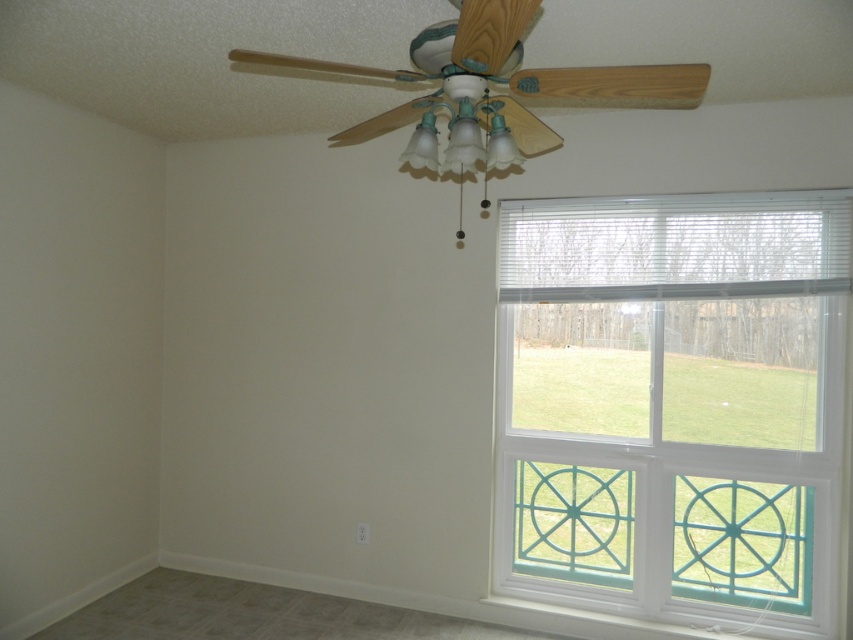
From the picture: You are standing in the room and want to know which object is wider between the white glass window at right and the wooden ceiling fan at upper center. Can you determine which one is wider?

The white glass window at right is wider than the wooden ceiling fan at upper center because its width surpasses the wooden ceiling fan at upper center.

You are standing in the corner of the room and want to look out the window. Which direction should you turn to face the white glass window at right from the wooden ceiling fan at upper center?

The white glass window at right is positioned on the right side of the wooden ceiling fan at upper center, so you should turn to your right to face the white glass window at right.

You are an interior designer planning to install a new light fixture in this room. The existing wooden ceiling fan at upper center is in the way of your desired placement. Can you replace it with the new fixture if the white glass window at right is larger?

The white glass window at right is larger than the wooden ceiling fan at upper center, so replacing the wooden ceiling fan at upper center with a new fixture should be possible since the window size does not directly affect the ceiling space availability. However, the size comparison between the existing and new fixtures would determine feasibility.